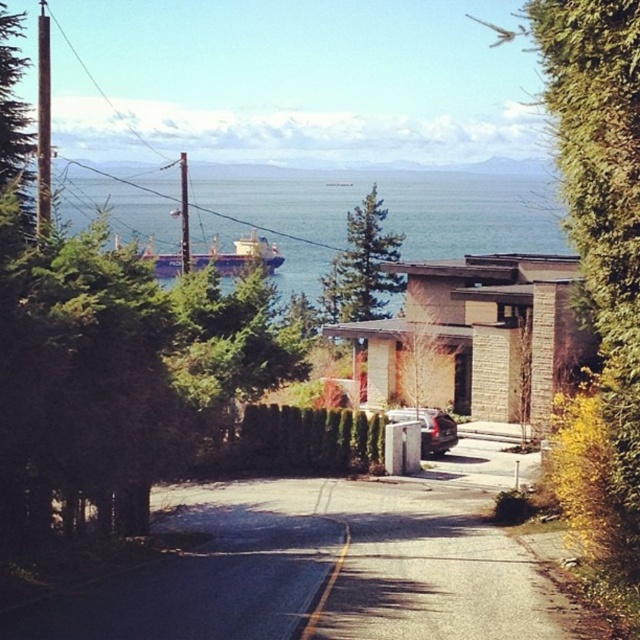
You are a delivery drone flying over the coastal area. You need to deliver a package to the house near the road. The drone has a height requirement of 2 meters to pass safely. Can the drone safely fly over the blue metallic water at upper center and the metallic silver car at center without hitting any obstacles?

The blue metallic water at upper center is taller than the metallic silver car at center. Since the drone requires a minimum height of 2 meters to pass safely, it can safely fly over both objects as long as the height of the blue metallic water at upper center is at least 2 meters. However, the exact height of the water isn not provided, so we cannot confirm if it meets the requirement. Please ensure the water level is above 2 meters before proceeding.

You are standing on the paved road and want to reach the blue metallic water at upper center. Which direction should you walk to avoid the metallic silver car at center?

The blue metallic water at upper center is located above the metallic silver car at center, so you should walk forward away from the car to reach the water.

You are driving a car and want to park it near the water. Based on the scene, can you determine if the blue metallic water at upper center is to the left or right of the metallic silver car at center?

The blue metallic water at upper center is to the left of the metallic silver car at center.